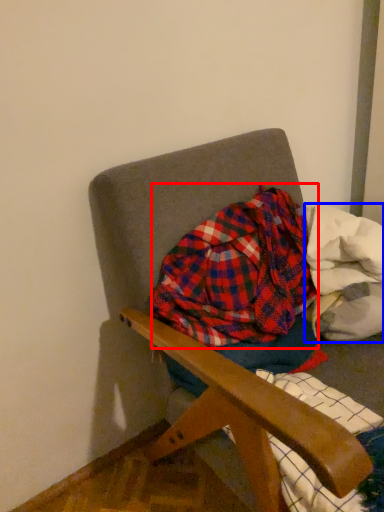
Question: Which object is closer to the camera taking this photo, flannel (highlighted by a red box) or material (highlighted by a blue box)?

Choices:
 (A) flannel
 (B) material

Answer: (A)